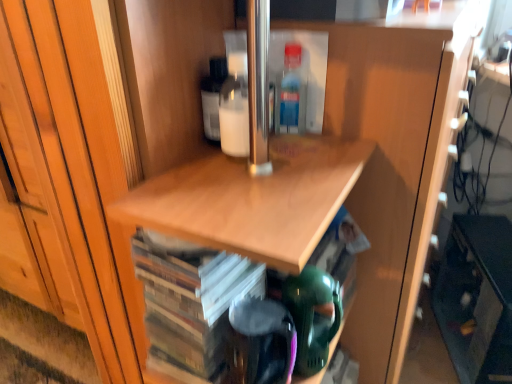
Question: From the image's perspective, is translucent plastic bottle at upper center below matte black cabinet at lower right?

Choices:
 (A) yes
 (B) no

Answer: (B)

Question: Is translucent plastic bottle at upper center not near matte black cabinet at lower right?

Choices:
 (A) no
 (B) yes

Answer: (B)

Question: Can you confirm if translucent plastic bottle at upper center is positioned to the right of matte black cabinet at lower right?

Choices:
 (A) yes
 (B) no

Answer: (B)

Question: Are translucent plastic bottle at upper center and matte black cabinet at lower right beside each other?

Choices:
 (A) no
 (B) yes

Answer: (A)

Question: Does translucent plastic bottle at upper center have a lesser width compared to matte black cabinet at lower right?

Choices:
 (A) yes
 (B) no

Answer: (A)

Question: Is wooden cd case at center wider or thinner than matte black cabinet at lower right?

Choices:
 (A) wide
 (B) thin

Answer: (B)

Question: Would you say wooden cd case at center is to the left or to the right of matte black cabinet at lower right in the picture?

Choices:
 (A) right
 (B) left

Answer: (B)

Question: Considering the positions of wooden cd case at center and matte black cabinet at lower right in the image, is wooden cd case at center taller or shorter than matte black cabinet at lower right?

Choices:
 (A) short
 (B) tall

Answer: (A)

Question: Does point (168, 344) appear closer or farther from the camera than point (467, 314)?

Choices:
 (A) farther
 (B) closer

Answer: (B)

Question: Based on their sizes in the image, would you say translucent plastic bottle at upper center is bigger or smaller than matte black cabinet at lower right?

Choices:
 (A) big
 (B) small

Answer: (B)

Question: From the image's perspective, is translucent plastic bottle at upper center located above or below matte black cabinet at lower right?

Choices:
 (A) below
 (B) above

Answer: (B)

Question: From a real-world perspective, is translucent plastic bottle at upper center above or below matte black cabinet at lower right?

Choices:
 (A) above
 (B) below

Answer: (A)

Question: Relative to matte black cabinet at lower right, is translucent plastic bottle at upper center in front or behind?

Choices:
 (A) behind
 (B) front

Answer: (B)

Question: From the image's perspective, is translucent plastic bottle at upper center above or below wooden cd case at center?

Choices:
 (A) above
 (B) below

Answer: (A)

Question: Is translucent plastic bottle at upper center inside the boundaries of wooden cd case at center, or outside?

Choices:
 (A) outside
 (B) inside

Answer: (A)